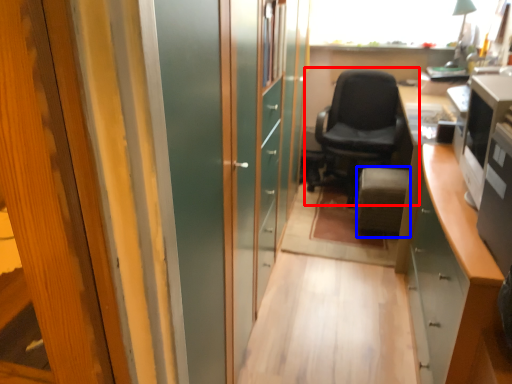
Question: Among these objects, which one is nearest to the camera, chair (highlighted by a red box) or furniture (highlighted by a blue box)?

Choices:
 (A) chair
 (B) furniture

Answer: (B)